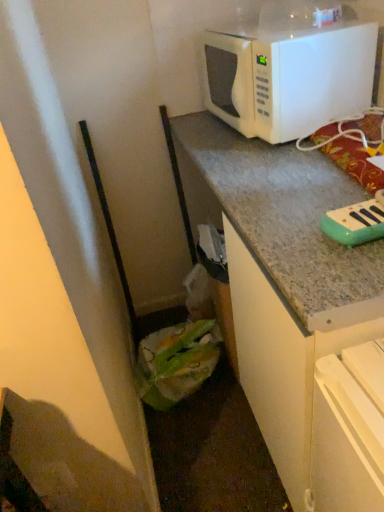
Question: From the image's perspective, is teal plastic toy piano at upper right located above or below green plastic bag at lower left?

Choices:
 (A) above
 (B) below

Answer: (A)

Question: Considering the relative positions of teal plastic toy piano at upper right and green plastic bag at lower left in the image provided, is teal plastic toy piano at upper right to the left or to the right of green plastic bag at lower left?

Choices:
 (A) left
 (B) right

Answer: (B)

Question: Estimate the real-world distances between objects in this image. Which object is farther from the green plastic bag at lower left?

Choices:
 (A) teal plastic toy piano at upper right
 (B) white matte microwave at upper right

Answer: (B)

Question: Which object is positioned closest to the white matte microwave at upper right?

Choices:
 (A) teal plastic toy piano at upper right
 (B) green plastic bag at lower left

Answer: (A)